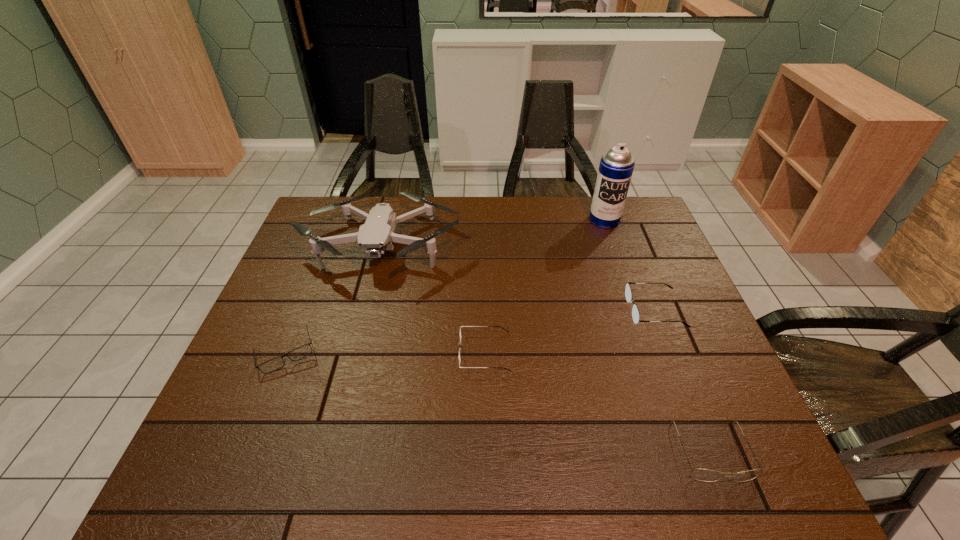
Image resolution: width=960 pixels, height=540 pixels. Find the location of `aerosol can that is at the right edge`. aerosol can that is at the right edge is located at coordinates (616, 167).

Identify the location of object that is at the far left corner. The image size is (960, 540). (375, 236).

At what (x,y) coordinates should I click in order to perform the action: click on object that is at the far right corner. Please return your answer as a coordinate pair (x, y). The height and width of the screenshot is (540, 960). Looking at the image, I should click on (616, 167).

Find the location of `object situated at the near right corner`. object situated at the near right corner is located at coordinates (705, 475).

I want to click on free space at the far edge of the desktop, so click(579, 237).

In the image, there is a desktop. Identify the location of vacant space at the left edge. This screenshot has height=540, width=960. (294, 249).

Where is `free space at the right edge of the desktop`? This screenshot has width=960, height=540. free space at the right edge of the desktop is located at coordinates (697, 380).

Identify the location of free space at the far left corner of the desktop. The width and height of the screenshot is (960, 540). (320, 232).

This screenshot has width=960, height=540. What are the coordinates of `vacant area at the near left corner` in the screenshot? It's located at (241, 448).

At what (x,y) coordinates should I click in order to perform the action: click on vacant space at the near right corner of the desktop. Please return your answer as a coordinate pair (x, y). This screenshot has width=960, height=540. Looking at the image, I should click on (771, 482).